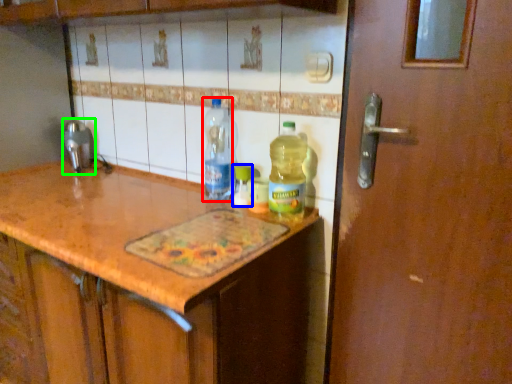
Question: Based on their relative distances, which object is farther from bottle (highlighted by a red box)? Choose from bottle (highlighted by a blue box) and faucet (highlighted by a green box).

Choices:
 (A) bottle
 (B) faucet

Answer: (B)